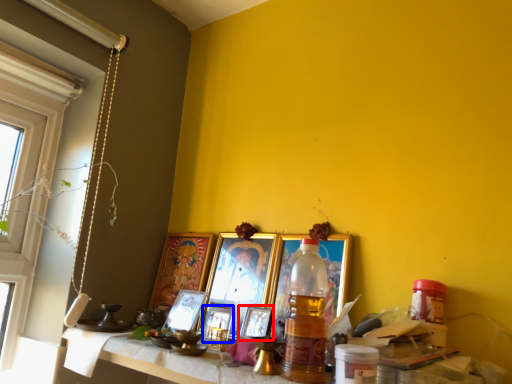
Question: Which of the following is the farthest to the observer, picture frame (highlighted by a red box) or picture frame (highlighted by a blue box)?

Choices:
 (A) picture frame
 (B) picture frame

Answer: (B)